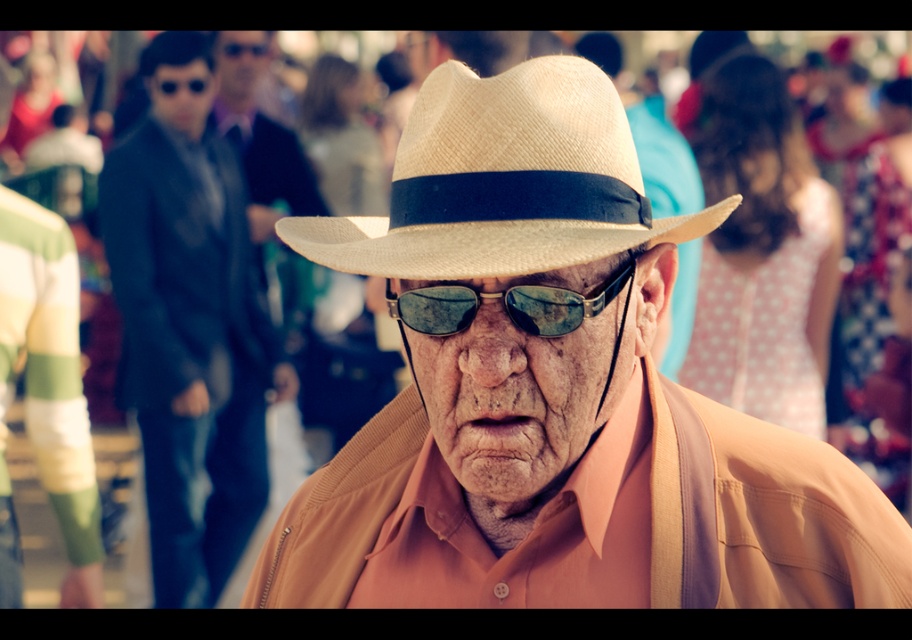
You are a photographer trying to capture a portrait of the elderly man. You notice the matte black jacket at left and the sunglasses at center. Which object should you focus on if you want to ensure the subject is in the center of your frame?

The sunglasses at center are positioned at the center of the image, so focusing on them will keep the subject in the center of the frame.

You are a photographer trying to capture the man in the image. You need to focus on the matte black jacket at left and the sunglasses at center. Which object should you adjust your camera focus to first if you want to ensure both are in focus, considering their positions?

The matte black jacket at left is positioned on the left side of sunglasses at center. To ensure both are in focus, you should focus on the sunglasses at center first, as it is closer to the camera than the matte black jacket at left.